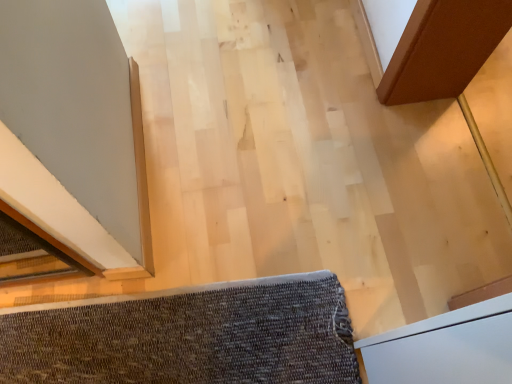
Where is `empty space that is ontop of textured gray mat at lower left (from a real-world perspective)`? empty space that is ontop of textured gray mat at lower left (from a real-world perspective) is located at coordinates [185, 335].